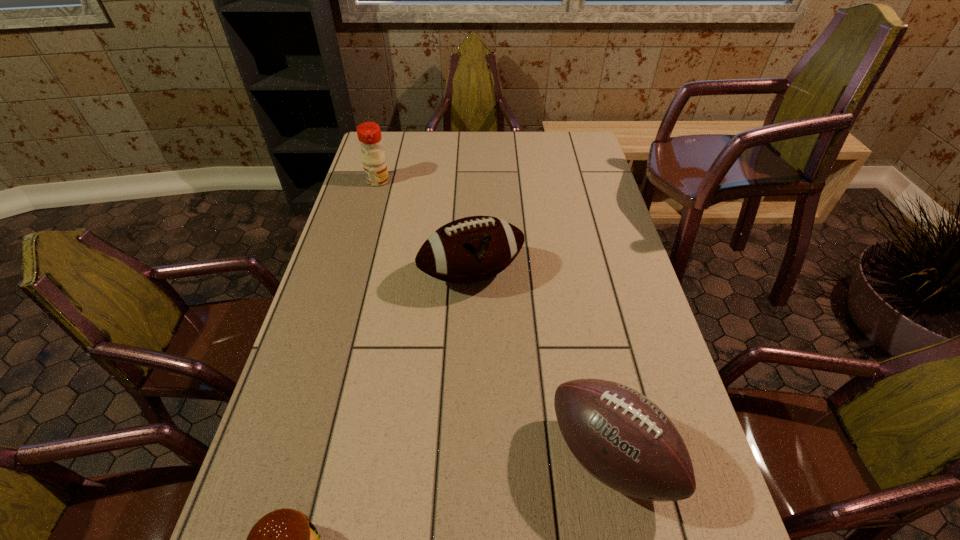
The width and height of the screenshot is (960, 540). Identify the location of vacant space at the far edge of the desktop. (451, 160).

Find the location of a particular element. This screenshot has width=960, height=540. vacant space at the left edge is located at coordinates (280, 460).

In the image, there is a desktop. At what (x,y) coordinates should I click in order to perform the action: click on vacant space at the right edge. Please return your answer as a coordinate pair (x, y). Image resolution: width=960 pixels, height=540 pixels. Looking at the image, I should click on (577, 242).

Identify the location of vacant space at the far left corner. (408, 141).

The width and height of the screenshot is (960, 540). I want to click on free space at the far right corner of the desktop, so click(x=552, y=134).

Where is `unoccupied position between the farthest object and the third nearest object`? The image size is (960, 540). unoccupied position between the farthest object and the third nearest object is located at coordinates click(x=424, y=227).

Locate an element on the screen. This screenshot has width=960, height=540. vacant area that lies between the rightmost object and the second farthest object is located at coordinates (540, 365).

At what (x,y) coordinates should I click in order to perform the action: click on empty location between the left football (American) and the farthest object. Please return your answer as a coordinate pair (x, y). Looking at the image, I should click on (424, 227).

Locate an element on the screen. This screenshot has height=540, width=960. free space between the second farthest object and the farthest object is located at coordinates (424, 227).

Find the location of a particular element. The image size is (960, 540). free spot between the farthest object and the left football (American) is located at coordinates (424, 227).